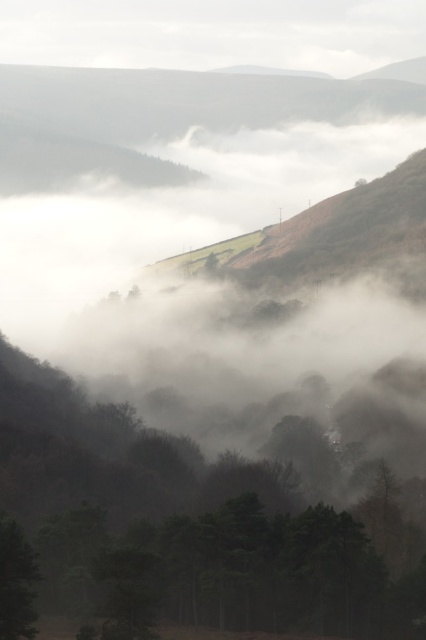
Is point (26, 356) positioned behind point (34, 577)?

Yes, point (26, 356) is behind point (34, 577).

Does green matte tree at center have a greater width compared to green matte tree at lower left?

Indeed, green matte tree at center has a greater width compared to green matte tree at lower left.

Describe the element at coordinates (204, 516) in the screenshot. I see `green matte tree at center` at that location.

What are the coordinates of `green matte tree at center` in the screenshot? It's located at (204, 516).